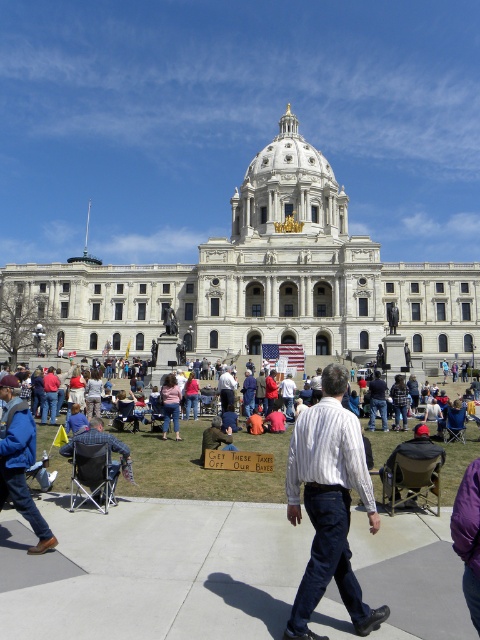
Is point (474, 483) behind point (123, 445)?

No, (474, 483) is closer to viewer.

Does purple fabric at lower right appear over plaid fabric chair at lower left?

Incorrect, purple fabric at lower right is not positioned above plaid fabric chair at lower left.

Between point (479, 509) and point (109, 472), which one is positioned behind?

Positioned behind is point (109, 472).

I want to click on purple fabric at lower right, so click(x=468, y=536).

Does point (370, 620) come farther from viewer compared to point (469, 541)?

No, (370, 620) is in front of (469, 541).

The width and height of the screenshot is (480, 640). I want to click on white striped shirt at center, so click(328, 504).

At what (x,y) coordinates should I click in order to perform the action: click on white striped shirt at center. Please return your answer as a coordinate pair (x, y). Looking at the image, I should click on (328, 504).

Which is above, blue denim jacket at lower left or plaid fabric chair at lower left?

blue denim jacket at lower left is above.

Does blue denim jacket at lower left have a lesser width compared to plaid fabric chair at lower left?

No.

Between point (1, 438) and point (121, 452), which one is positioned behind?

The point (121, 452) is more distant.

This screenshot has height=640, width=480. I want to click on blue denim jacket at lower left, so click(x=20, y=461).